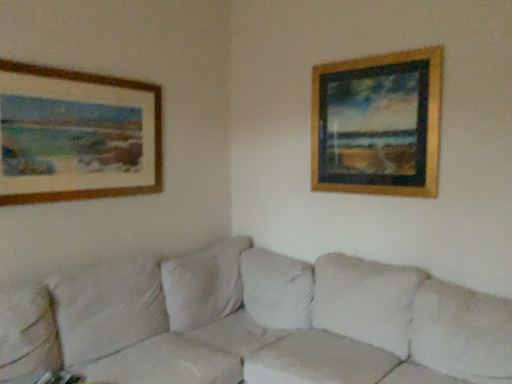
Question: Is gold wooden picture frame at upper right, the 2th picture frame positioned from the left, inside the boundaries of white fabric couch at center, or outside?

Choices:
 (A) inside
 (B) outside

Answer: (B)

Question: In terms of height, does gold wooden picture frame at upper right, the 2th picture frame positioned from the left, look taller or shorter compared to white fabric couch at center?

Choices:
 (A) tall
 (B) short

Answer: (A)

Question: Considering the real-world distances, which object is farthest from the white fabric couch at center?

Choices:
 (A) gold wooden picture frame at upper right, the 2th picture frame positioned from the left
 (B) wooden picture frame at upper left, placed as the 1th picture frame when sorted from left to right

Answer: (A)

Question: Which of these objects is positioned closest to the white fabric couch at center?

Choices:
 (A) wooden picture frame at upper left, which is the second picture frame in right-to-left order
 (B) gold wooden picture frame at upper right, the 2th picture frame positioned from the left

Answer: (A)